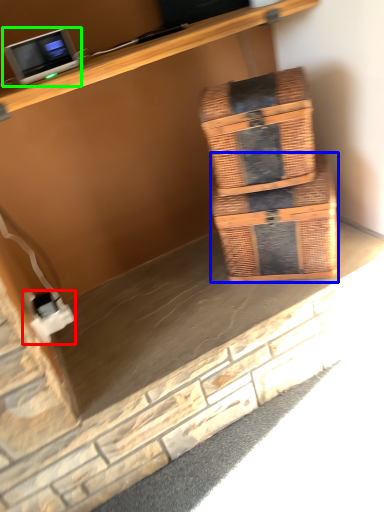
Question: Which object is the farthest from electric outlet (highlighted by a red box)? Choose among these: box (highlighted by a blue box) or desktop computer (highlighted by a green box).

Choices:
 (A) box
 (B) desktop computer

Answer: (A)